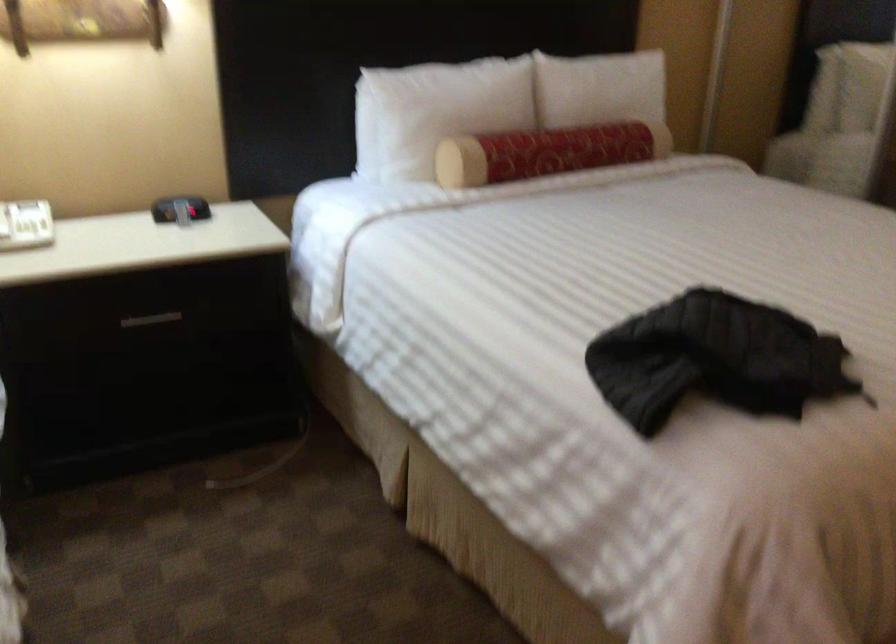
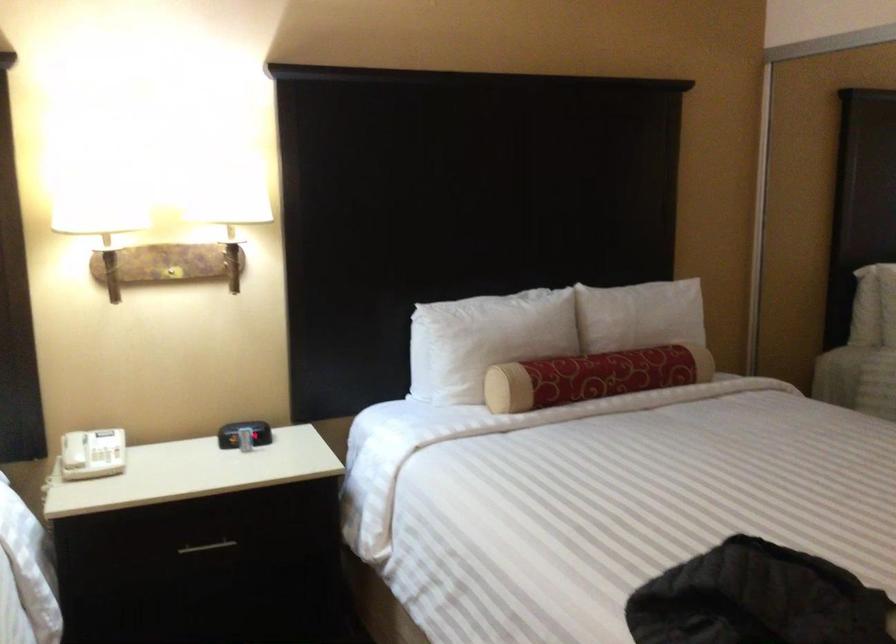
Locate, in the second image, the point that corresponds to point 186,207 in the first image.

(244, 433)